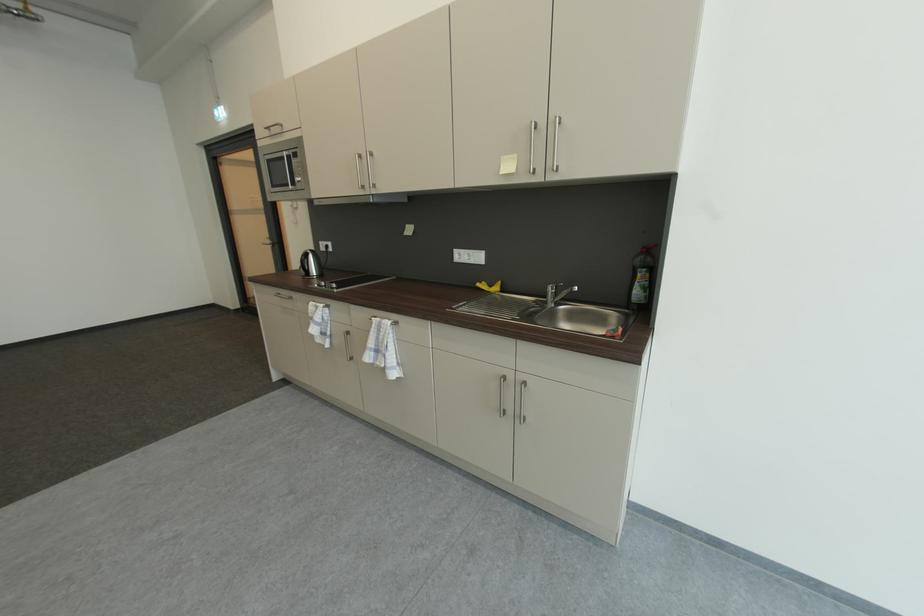
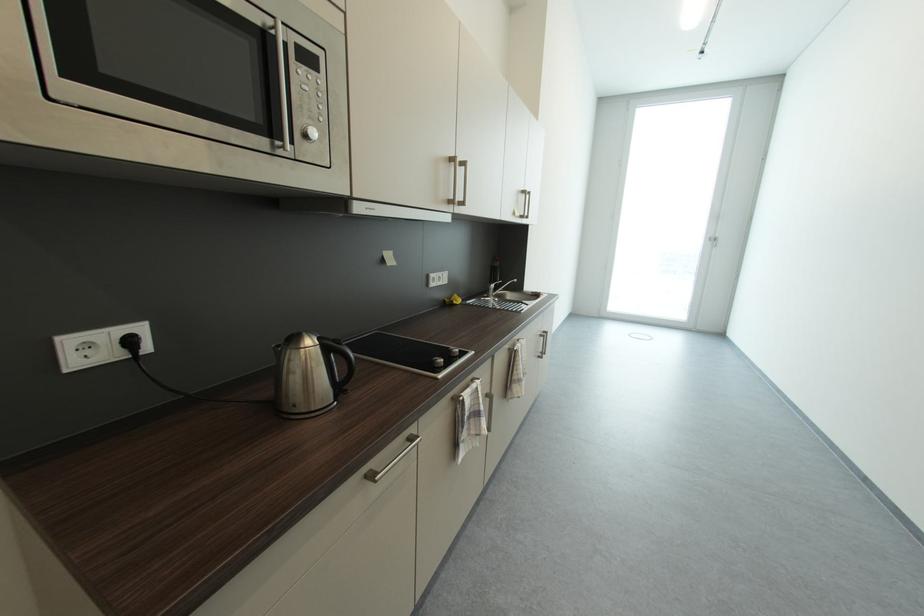
Locate, in the second image, the point that corresponds to (x=378, y=322) in the first image.

(523, 351)